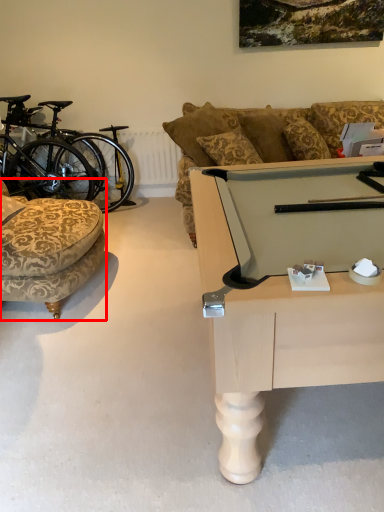
Question: Observing the image, what is the correct spatial positioning of chair (annotated by the red box) in reference to bicycle?

Choices:
 (A) left
 (B) right

Answer: (B)